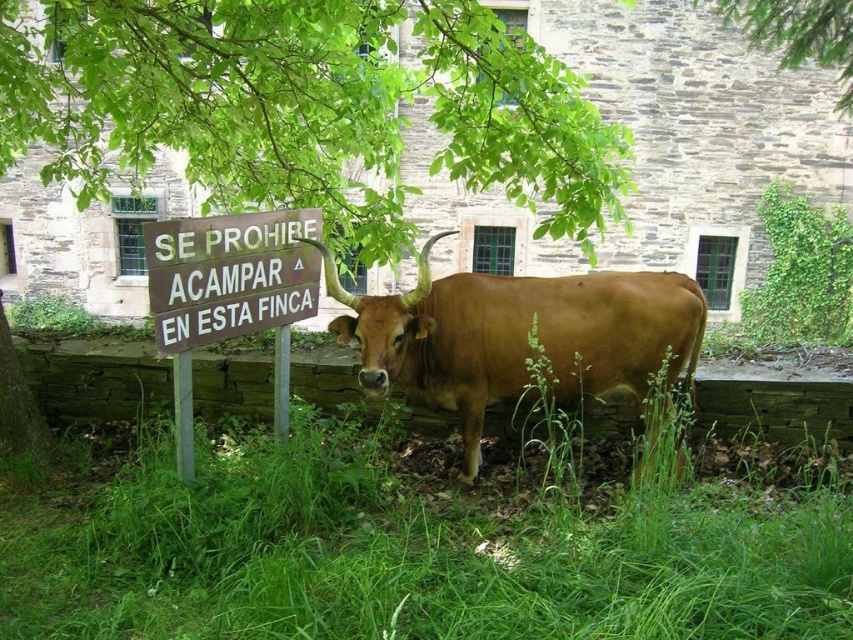
Between point (248, 556) and point (556, 289), which one is positioned in front?

Positioned in front is point (248, 556).

Can you confirm if green grass at center is positioned to the right of brown glossy bull at center?

No, green grass at center is not to the right of brown glossy bull at center.

The image size is (853, 640). What are the coordinates of `green grass at center` in the screenshot? It's located at (421, 541).

Is point (579, 227) more distant than point (529, 310)?

Yes, it is behind point (529, 310).

The image size is (853, 640). Find the location of `green leafy tree at upper center`. green leafy tree at upper center is located at coordinates (303, 106).

Where is `green leafy tree at upper center`? This screenshot has width=853, height=640. green leafy tree at upper center is located at coordinates (303, 106).

In the scene shown: Between green grass at center and green leafy tree at upper center, which one is positioned higher?

green leafy tree at upper center

Is green grass at center taller than green leafy tree at upper center?

Correct, green grass at center is much taller as green leafy tree at upper center.

Between point (134, 451) and point (138, 152), which one is positioned in front?

Point (134, 451) is more forward.

Locate an element on the screen. green grass at center is located at coordinates pyautogui.click(x=421, y=541).